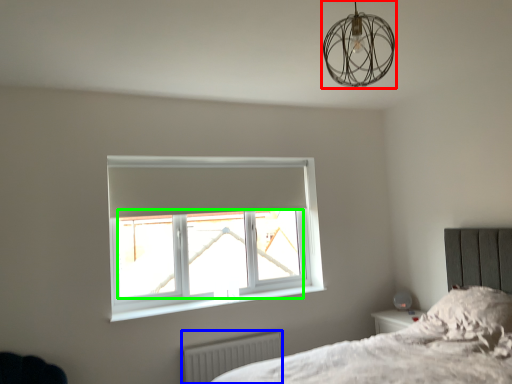
Question: Which object is the closest to the lamp (highlighted by a red box)? Choose among these: radiator (highlighted by a blue box) or window screen (highlighted by a green box).

Choices:
 (A) radiator
 (B) window screen

Answer: (B)